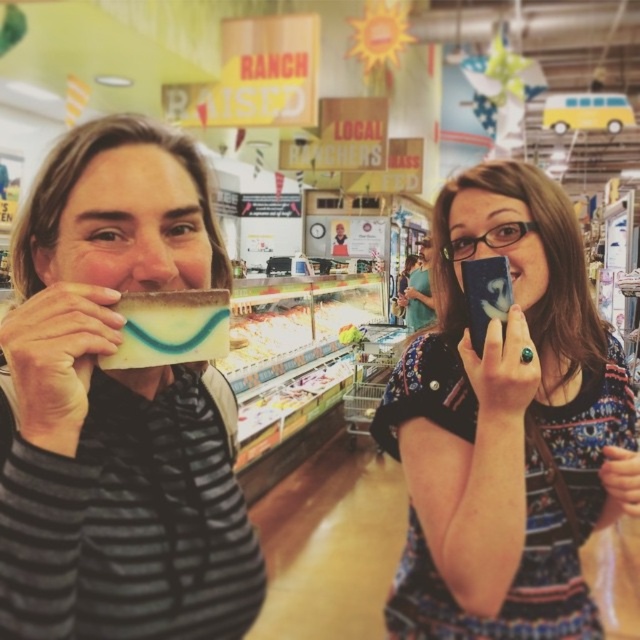
Question: Which object is positioned farthest from the matte black phone at center?

Choices:
 (A) smooth plastic container at center
 (B) matte yellow cheese at left

Answer: (A)

Question: Does transparent plastic glasses at upper center have a greater width compared to smooth plastic container at center?

Choices:
 (A) yes
 (B) no

Answer: (B)

Question: Is transparent plastic glasses at upper center thinner than smooth plastic container at center?

Choices:
 (A) no
 (B) yes

Answer: (B)

Question: Does matte yellow cheese at left appear on the left side of matte black phone at center?

Choices:
 (A) yes
 (B) no

Answer: (A)

Question: Which point is farther to the camera?

Choices:
 (A) smooth plastic container at center
 (B) transparent plastic glasses at upper center
 (C) matte yellow cheese at left
 (D) matte black phone at center

Answer: (A)

Question: Which point appears closest to the camera in this image?

Choices:
 (A) (141, 490)
 (B) (112, 353)
 (C) (554, 282)
 (D) (339, 330)

Answer: (B)